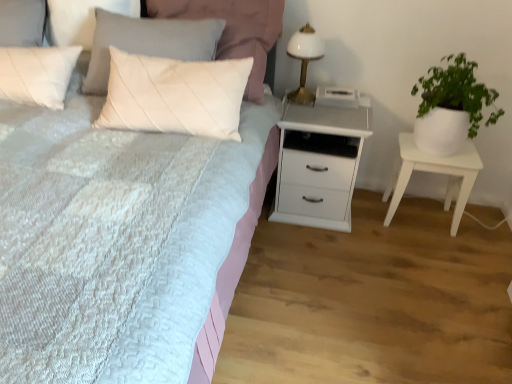
Identify the location of vacant space situated above white wood chest of drawers at center (from a real-world perspective). (324, 107).